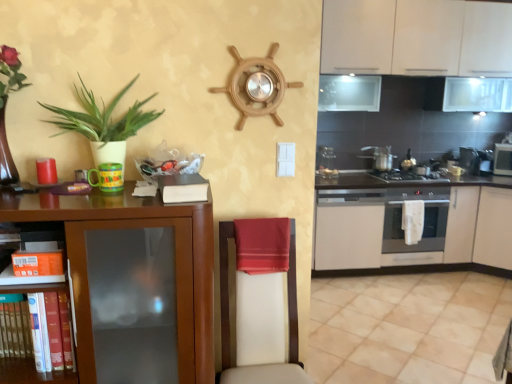
Question: In the image, is white matte cabinet at lower right, which appears as the 4th cabinetry when viewed from the front, positioned in front of or behind red satin towel at center?

Choices:
 (A) behind
 (B) front

Answer: (A)

Question: In the image, is white matte cabinet at lower right, positioned as the 1th cabinetry in back-to-front order, on the left side or the right side of red satin towel at center?

Choices:
 (A) right
 (B) left

Answer: (A)

Question: Based on their relative distances, which object is farther from the green matte plant at left?

Choices:
 (A) metallic stainless steel microwave at right, the 1th appliance from the right
 (B) silver metallic pot at center, the third appliance positioned from the left
 (C) metallic silver oven at right, the third appliance when ordered from right to left
 (D) white matte cabinet at lower right, which appears as the 4th cabinetry when viewed from the front
 (E) white leather swivel chair at center

Answer: (A)

Question: Which is farther from the stainless steel oven at center right?

Choices:
 (A) white matte cabinet at lower right, which appears as the 4th cabinetry when viewed from the front
 (B) silver metallic pot at center, the fourth appliance viewed from the back
 (C) metallic stainless steel microwave at right, marked as the second appliance in a back-to-front arrangement
 (D) stainless steel oven at right, arranged as the second appliance when viewed from the right
 (E) red satin towel at center

Answer: (E)